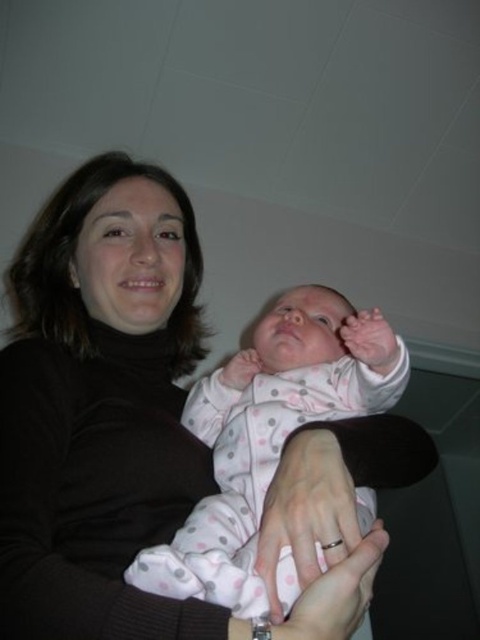
You are a photographer setting up a shot of the scene described. You need to position a spotlight so it illuminates the matte black sweater at center and the pink polka dot fabric at center. Since the spotlight can only shine on one object at a time, which object should you aim it at first if you want to ensure both are lit without moving the spotlight?

The matte black sweater at center is much taller than the pink polka dot fabric at center, so you should aim the spotlight at the matte black sweater at center first. This way, the light will naturally cascade down to the shorter pink polka dot fabric at center, ensuring both are illuminated without needing to adjust the spotlight.

You are an interior designer analyzing the color scheme of the room. The baby is wearing a light onesie with pink and gray polka dots. The adult is wearing a dark turtleneck sweater. Which object corresponds to the point marked at coordinates (x=100, y=410)?

The point at coordinates (x=100, y=410) corresponds to the matte black sweater at center.